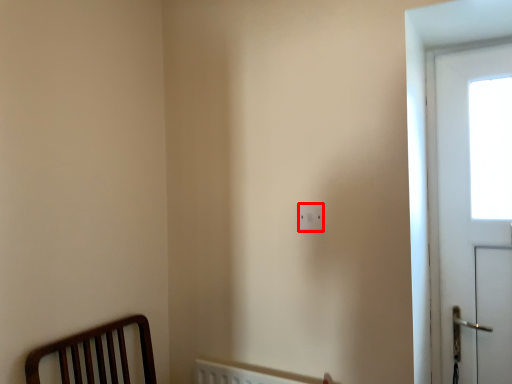
Question: From the image's perspective, where is light switch (annotated by the red box) located relative to screen door?

Choices:
 (A) below
 (B) above

Answer: (A)